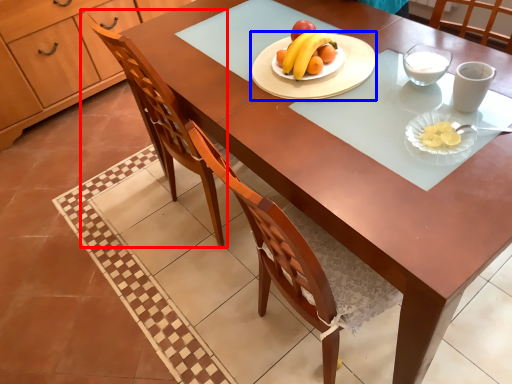
Question: Among these objects, which one is farthest to the camera, chair (highlighted by a red box) or platter (highlighted by a blue box)?

Choices:
 (A) chair
 (B) platter

Answer: (B)